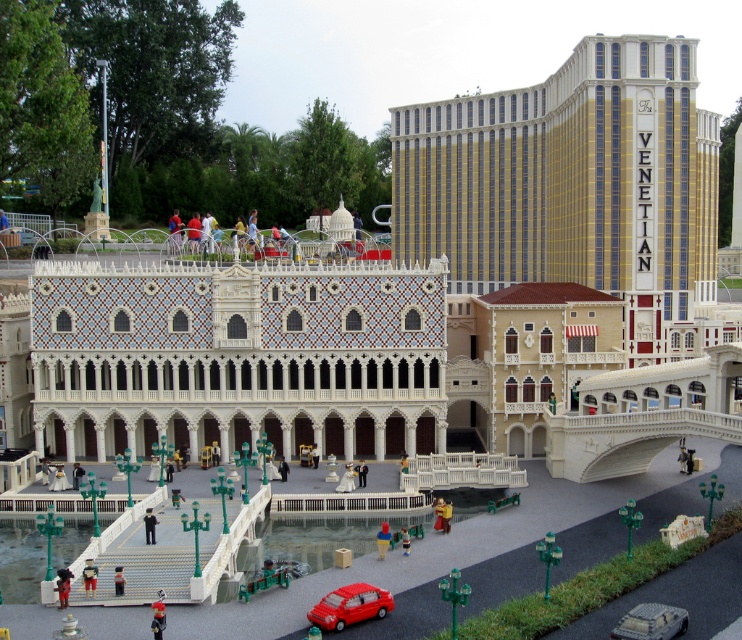
Question: Is gold mosaic hotel at upper right in front of matte red car at lower center?

Choices:
 (A) yes
 (B) no

Answer: (B)

Question: Which of the following is the closest to the observer?

Choices:
 (A) (643, 611)
 (B) (637, 92)

Answer: (A)

Question: Among these objects, which one is farthest from the camera?

Choices:
 (A) smooth plastic figure at center
 (B) brick-like figure at center

Answer: (B)

Question: Considering the relative positions of gold mosaic hotel at upper right and brick-like figure at center in the image provided, where is gold mosaic hotel at upper right located with respect to brick-like figure at center?

Choices:
 (A) below
 (B) above

Answer: (B)

Question: Which object is closer to the camera taking this photo?

Choices:
 (A) black fabric person at center
 (B) dark red fabric dress at lower left
 (C) smooth plastic figure at center
 (D) brick-like figure at center

Answer: (B)

Question: Does dark red fabric dress at lower left appear under brick-like figure at center?

Choices:
 (A) yes
 (B) no

Answer: (B)